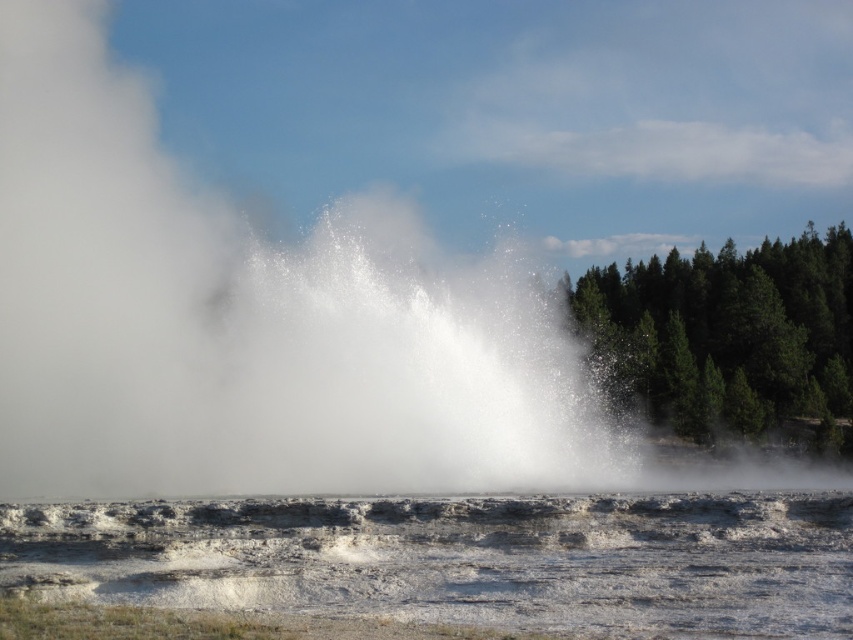
Question: Which of these objects is positioned closest to the green textured trees at right?

Choices:
 (A) white rocky water at center
 (B) white vapor at center

Answer: (B)

Question: Does white vapor at center appear over green textured trees at right?

Choices:
 (A) yes
 (B) no

Answer: (A)

Question: Which of the following is the farthest from the observer?

Choices:
 (A) (274, 330)
 (B) (850, 518)

Answer: (A)

Question: Which point is closer to the camera taking this photo?

Choices:
 (A) (361, 435)
 (B) (57, 564)

Answer: (B)

Question: Is white vapor at center to the left of white rocky water at center from the viewer's perspective?

Choices:
 (A) no
 (B) yes

Answer: (B)

Question: Where is white rocky water at center located in relation to green textured trees at right in the image?

Choices:
 (A) right
 (B) left

Answer: (B)